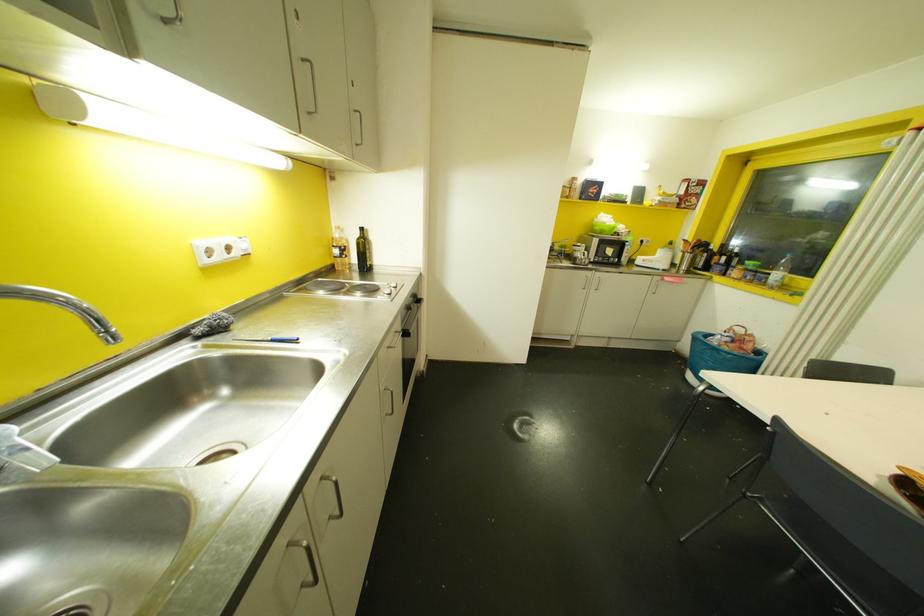
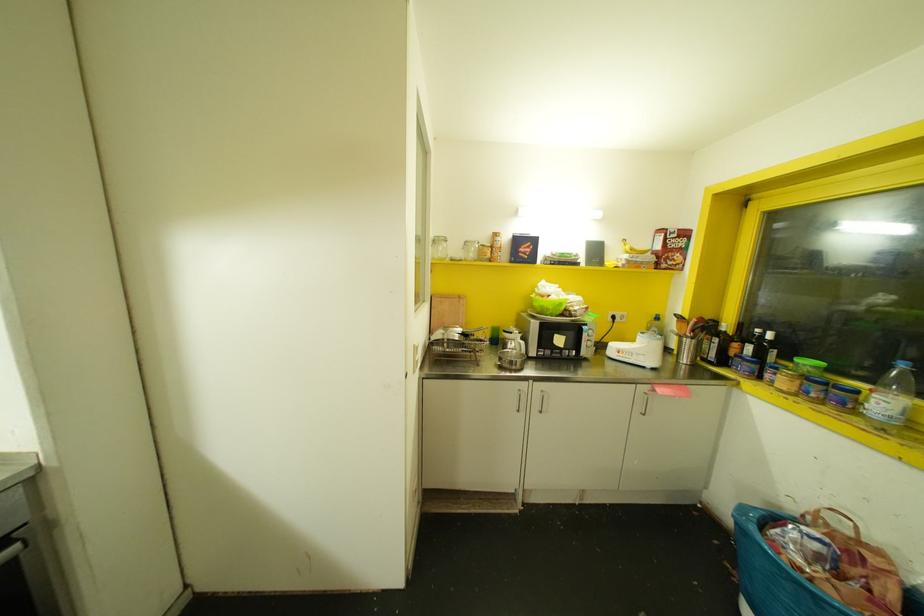
Where in the second image is the point corresponding to the point at 723,257 from the first image?

(748, 347)